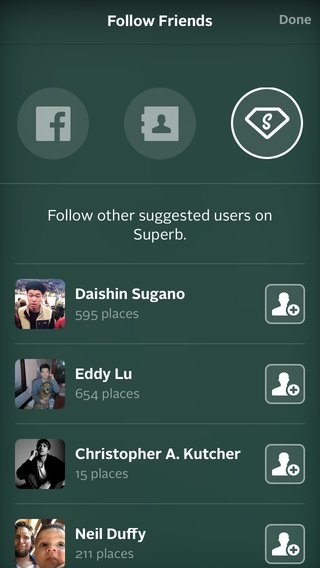
I want to click on picture, so click(x=52, y=540).